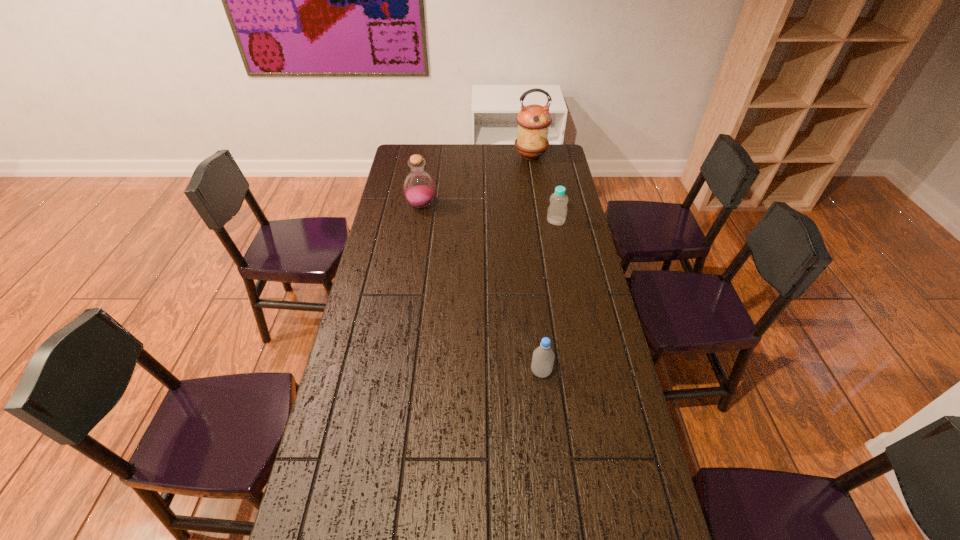
Find the location of a particular element. oil lamp is located at coordinates click(533, 121).

Find the location of a particular element. The width and height of the screenshot is (960, 540). the tallest object is located at coordinates (533, 121).

At what (x,y) coordinates should I click in order to perform the action: click on the leftmost bottle. Please return your answer as a coordinate pair (x, y). Image resolution: width=960 pixels, height=540 pixels. Looking at the image, I should click on (419, 189).

This screenshot has height=540, width=960. Find the location of `the tallest bottle`. the tallest bottle is located at coordinates (419, 189).

The image size is (960, 540). Identify the location of the rightmost bottle. (557, 211).

Find the location of a particular element. This screenshot has width=960, height=540. the second farthest bottle is located at coordinates (557, 211).

You are a GUI agent. You are given a task and a screenshot of the screen. Output one action in this format:
    pyautogui.click(x=<x>, y=<y>)
    Task: Click on the nearest object
    This screenshot has width=960, height=540.
    Given the screenshot: What is the action you would take?
    pyautogui.click(x=543, y=357)

The height and width of the screenshot is (540, 960). What are the coordinates of `the nearest bottle` in the screenshot? It's located at (543, 357).

The width and height of the screenshot is (960, 540). Identify the location of free space located on the left of the oil lamp. (445, 156).

The height and width of the screenshot is (540, 960). What are the coordinates of `blank space located 0.130m on the right of the tallest bottle` in the screenshot? It's located at (467, 206).